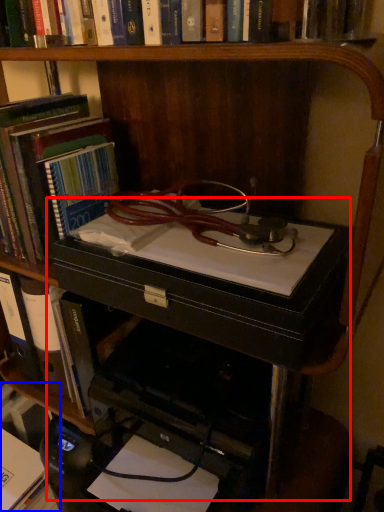
Question: Which point is closer to the camera, computer desk (highlighted by a red box) or book (highlighted by a blue box)?

Choices:
 (A) computer desk
 (B) book

Answer: (A)